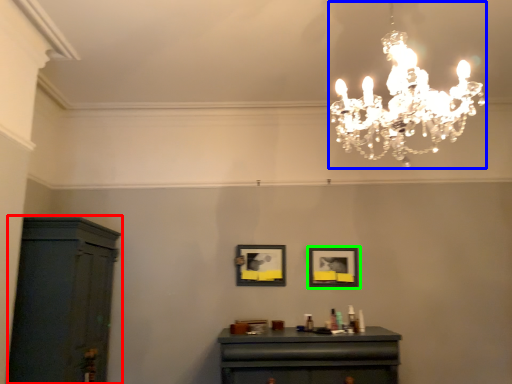
Question: Which object is positioned closest to cabinetry (highlighted by a red box)? Select from lamp (highlighted by a blue box) and picture frame (highlighted by a green box).

Choices:
 (A) lamp
 (B) picture frame

Answer: (B)